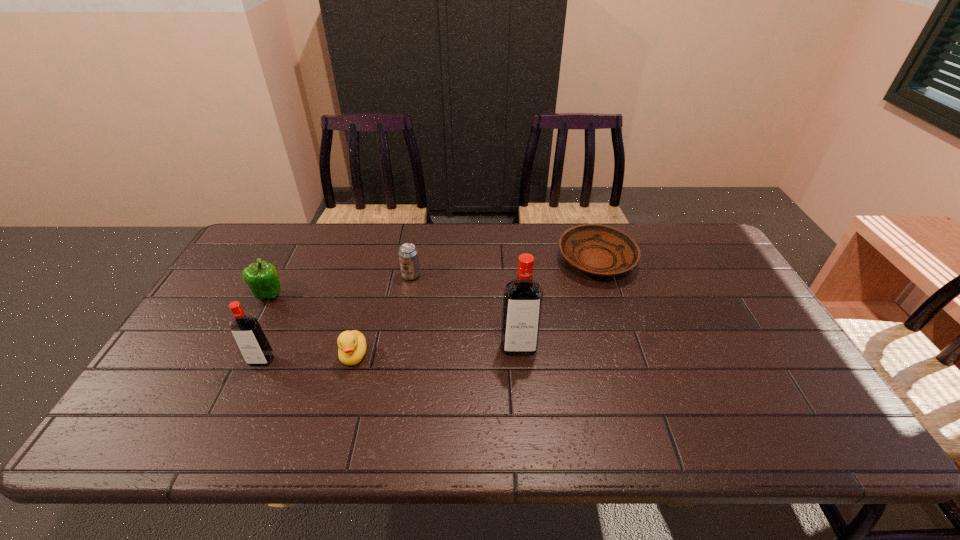
You are a GUI agent. You are given a task and a screenshot of the screen. Output one action in this format:
    pyautogui.click(x=<x>, y=<y>)
    Task: Click on the fourth shortest object
    This screenshot has height=540, width=960.
    Given the screenshot: What is the action you would take?
    pyautogui.click(x=262, y=278)

Where is `free space located 0.100m on the front and back of the second object from right to left`? The width and height of the screenshot is (960, 540). free space located 0.100m on the front and back of the second object from right to left is located at coordinates (522, 390).

At what (x,y) coordinates should I click in order to perform the action: click on vacant space located 0.390m on the front of the plate. Please return your answer as a coordinate pair (x, y). Looking at the image, I should click on (640, 398).

Locate an element on the screen. blank area located 0.320m on the right of the third shortest object is located at coordinates (523, 275).

Locate an element on the screen. The width and height of the screenshot is (960, 540). free space located on the back of the third tallest object is located at coordinates (283, 268).

I want to click on object situated at the far edge, so click(x=599, y=250).

Image resolution: width=960 pixels, height=540 pixels. I want to click on object situated at the left edge, so click(262, 278).

You are a GUI agent. You are given a task and a screenshot of the screen. Output one action in this format:
    pyautogui.click(x=<x>, y=<y>)
    Task: Click on the vacant space at the far edge of the desktop
    
    Given the screenshot: What is the action you would take?
    pyautogui.click(x=445, y=256)

You are a GUI agent. You are given a task and a screenshot of the screen. Output one action in this format:
    pyautogui.click(x=<x>, y=<y>)
    Task: Click on the vacant space at the near edge of the desktop
    
    Given the screenshot: What is the action you would take?
    pyautogui.click(x=310, y=382)

Identify the location of vacant region at the left edge of the desktop. The width and height of the screenshot is (960, 540). (228, 305).